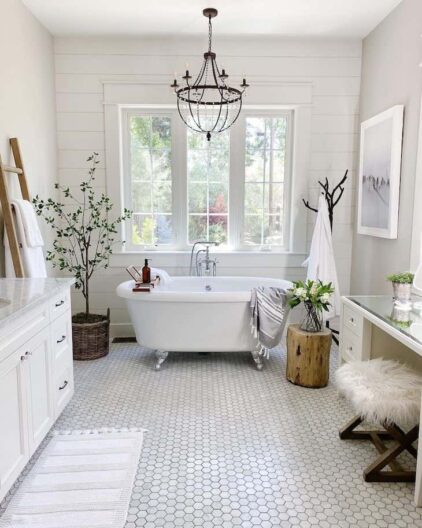
Where is `vase of white flowers`? Image resolution: width=422 pixels, height=528 pixels. vase of white flowers is located at coordinates (312, 311).